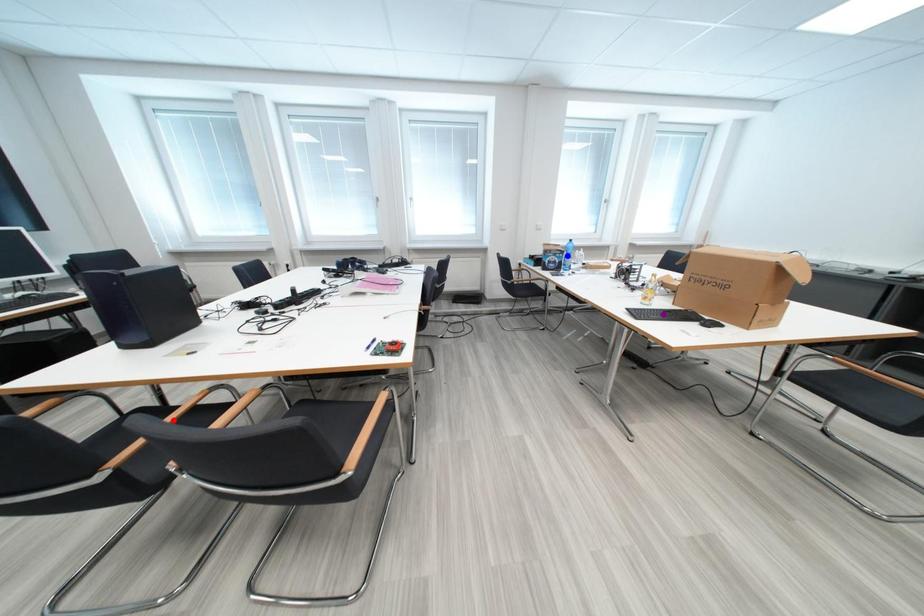
Order these from nearest to farthest:
purple point, red point, blue point

1. red point
2. purple point
3. blue point